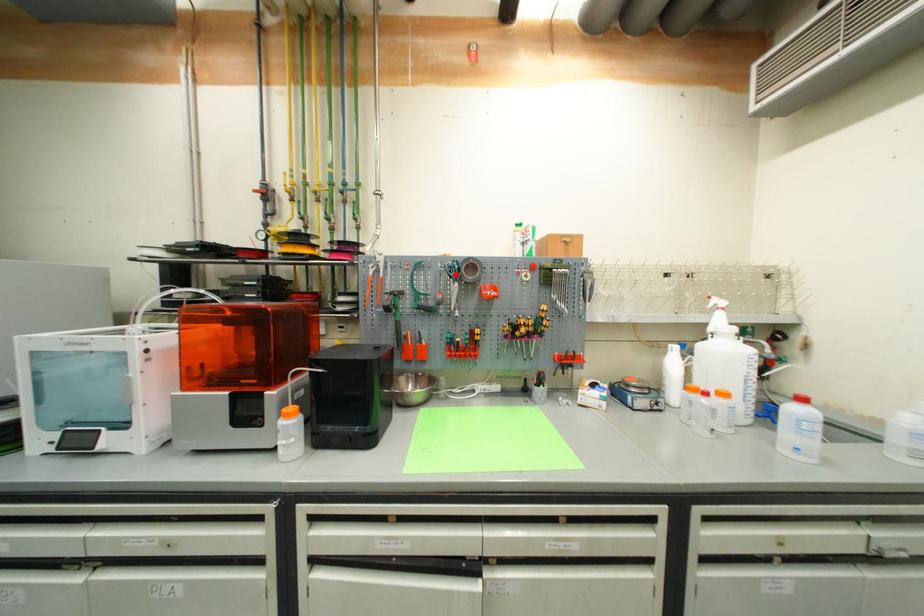
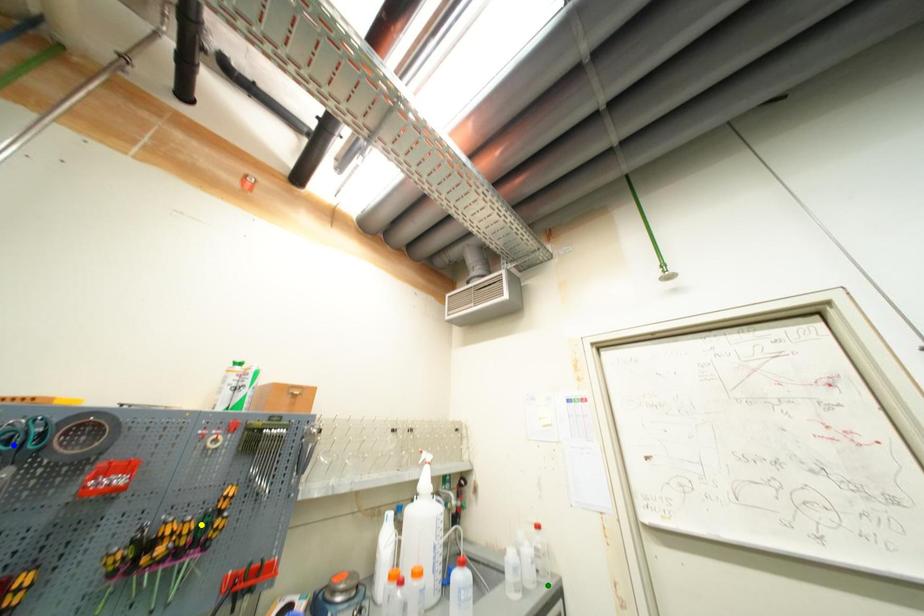
Question: I am providing you with two images of the same scene from different viewpoints. A red point is marked on the first image. You are given multiple points on the second image. Can you choose the point in image 2 that corresponds to the point in image 1?

Choices:
 (A) green point
 (B) blue point
 (C) yellow point

Answer: (B)